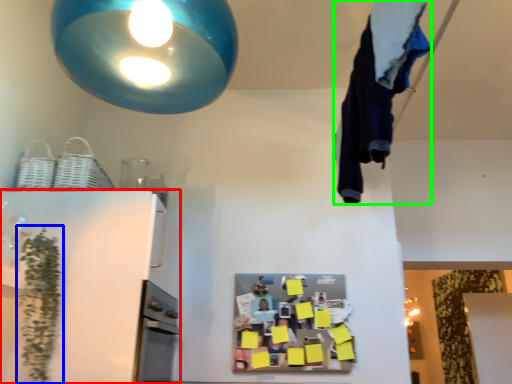
Question: Which is nearer to the appliance (highlighted by a red box)? plant (highlighted by a blue box) or laundry (highlighted by a green box).

Choices:
 (A) plant
 (B) laundry

Answer: (A)